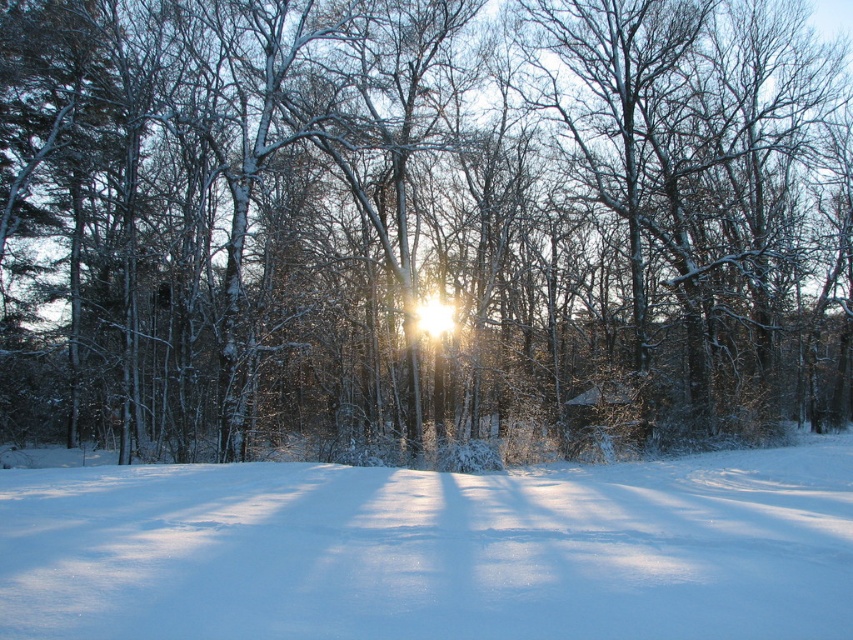
Is white snow-covered tree at center behind white fluffy snow at center?

Yes, it is.

Which is behind, point (212, 339) or point (384, 570)?

Positioned behind is point (212, 339).

Does point (109, 324) come behind point (283, 536)?

Yes, point (109, 324) is behind point (283, 536).

Where is `white snow-covered tree at center`? Image resolution: width=853 pixels, height=640 pixels. white snow-covered tree at center is located at coordinates (421, 225).